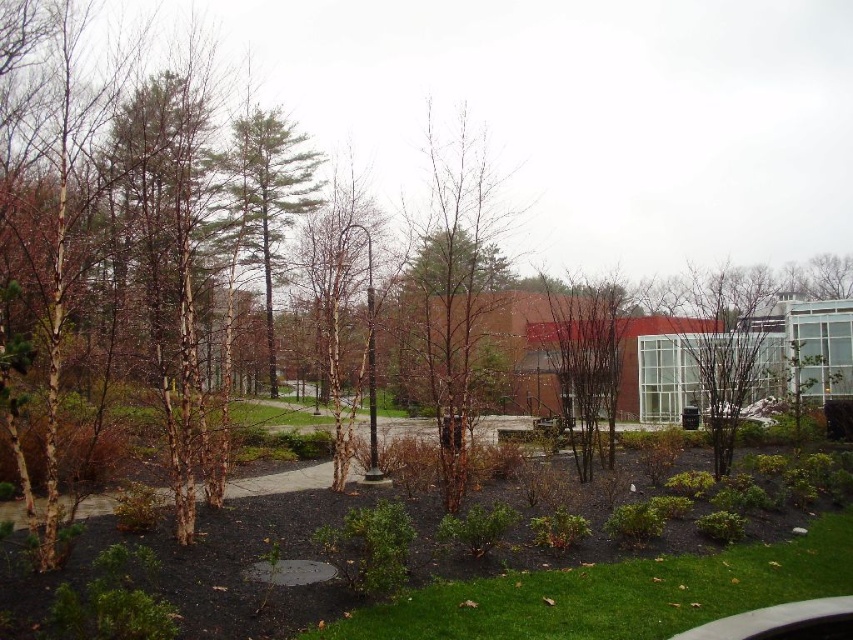
You are standing at the entrance of the building in the background and want to plant a new tree in the exact center of the lawn area. The green textured pine tree at center is currently blocking the spot. Can you move it to a new location that is 0.2 units to the right and 0.1 units up from its current position?

The green textured pine tree at center is currently at point (265, 196). Moving it 0.2 units to the right and 0.1 units up would place it at point (351, 324). This new location should be clear of obstacles as long as there are no other objects in that area.

You are standing at the center of the image and want to locate the bare branches at right. According to the coordinates provided, in which direction should you look to find them?

The bare branches at right are located at coordinates point (723,342), so you should look towards the upper right direction from your current position at the center of the image.

You are standing on the pathway and see two sets of bare branches in the scene. Which one is located to the right of the other? The options are the bare branches at right and the bare branches at center.

The bare branches at right is positioned on the right side of the bare branches at center.